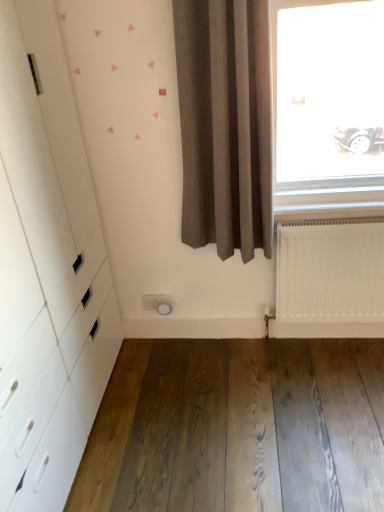
You are a GUI agent. You are given a task and a screenshot of the screen. Output one action in this format:
    pyautogui.click(x=<x>, y=<y>)
    Task: Click on the free point above natural wood floor at lower center (from a real-world perspective)
    Image resolution: width=384 pixels, height=512 pixels.
    Given the screenshot: What is the action you would take?
    pyautogui.click(x=242, y=409)